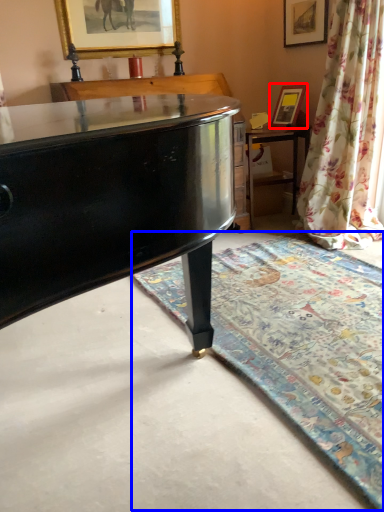
Question: Which object appears closest to the camera in this image, picture frame (highlighted by a red box) or mat (highlighted by a blue box)?

Choices:
 (A) picture frame
 (B) mat

Answer: (B)